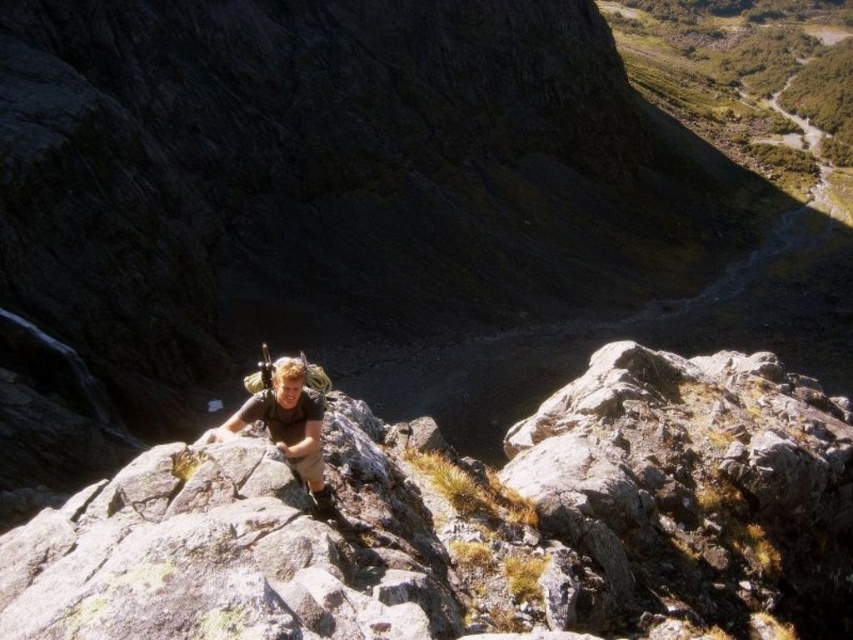
You are a hiker trying to climb the steep incline shown in the image. You notice a gray rock at center and a matte brown shirt at center. Which object would you choose to use as a handhold for better grip and stability during your ascent?

The gray rock at center has a larger size compared to the matte brown shirt at center, so it would provide a more stable handhold for climbing.